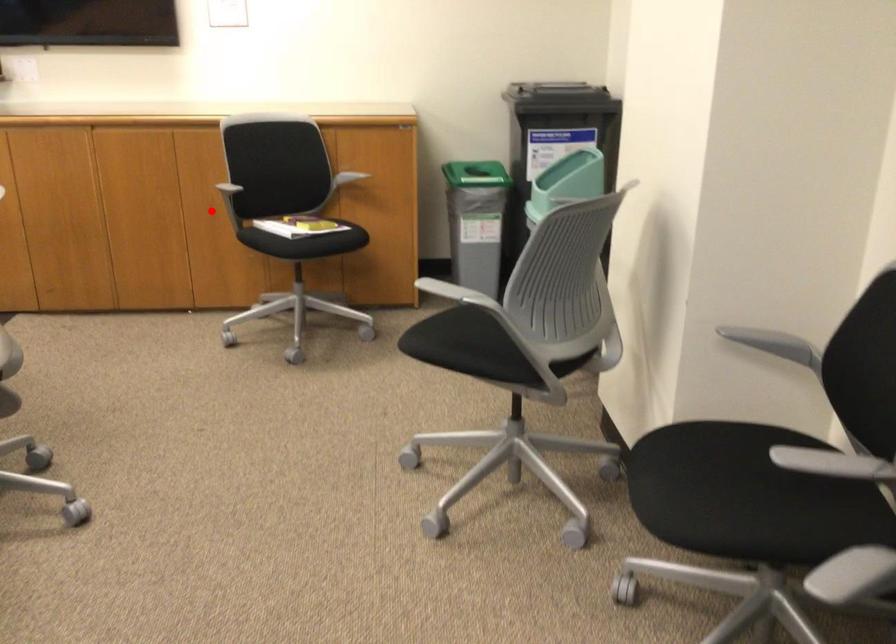
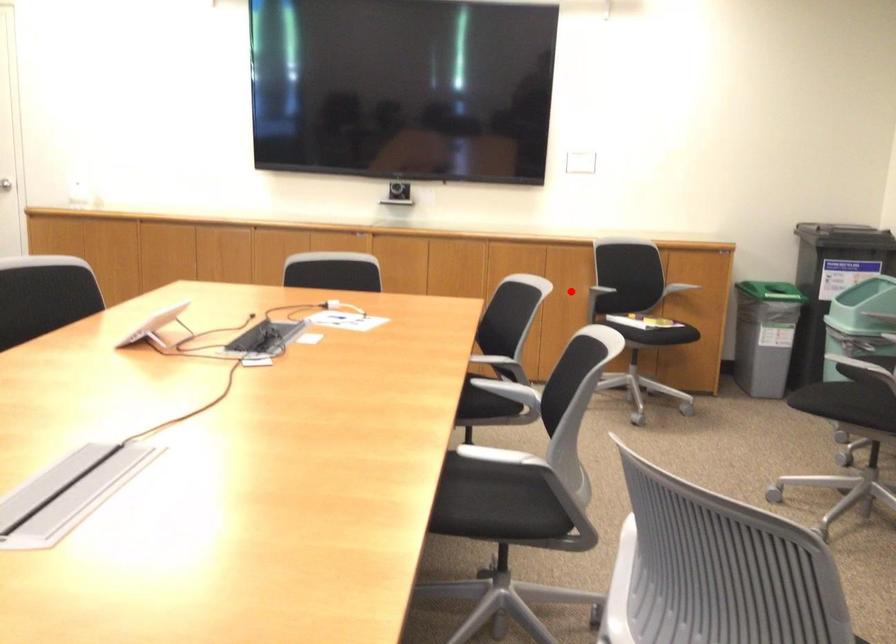
I am providing you with two images of the same scene from different viewpoints. A red point is marked on the first image and another point is marked on the second image. Do the highlighted points in image1 and image2 indicate the same real-world spot?

Yes